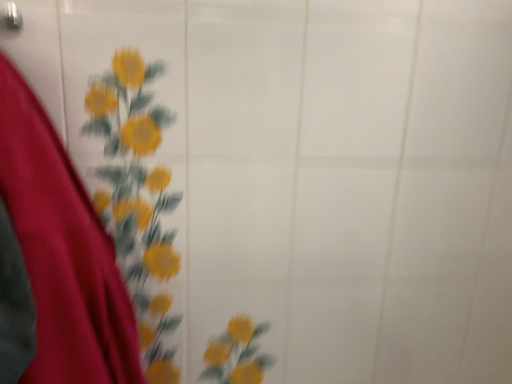
Question: From the image's perspective, is velvet red dress at left under metallic silver door handle at upper left?

Choices:
 (A) yes
 (B) no

Answer: (A)

Question: Considering the relative sizes of velvet red dress at left and metallic silver door handle at upper left in the image provided, is velvet red dress at left wider than metallic silver door handle at upper left?

Choices:
 (A) yes
 (B) no

Answer: (A)

Question: From the image's perspective, would you say velvet red dress at left is positioned over metallic silver door handle at upper left?

Choices:
 (A) yes
 (B) no

Answer: (B)

Question: From a real-world perspective, is velvet red dress at left below metallic silver door handle at upper left?

Choices:
 (A) yes
 (B) no

Answer: (A)

Question: Is the surface of velvet red dress at left in direct contact with metallic silver door handle at upper left?

Choices:
 (A) yes
 (B) no

Answer: (B)

Question: Is velvet red dress at left to the left of metallic silver door handle at upper left from the viewer's perspective?

Choices:
 (A) no
 (B) yes

Answer: (A)

Question: From the image's perspective, is metallic silver door handle at upper left located above velvet red dress at left?

Choices:
 (A) yes
 (B) no

Answer: (A)

Question: Does metallic silver door handle at upper left contain velvet red dress at left?

Choices:
 (A) no
 (B) yes

Answer: (A)

Question: Is metallic silver door handle at upper left wider than velvet red dress at left?

Choices:
 (A) no
 (B) yes

Answer: (A)

Question: From a real-world perspective, is metallic silver door handle at upper left positioned under velvet red dress at left based on gravity?

Choices:
 (A) yes
 (B) no

Answer: (B)

Question: Is metallic silver door handle at upper left oriented towards velvet red dress at left?

Choices:
 (A) yes
 (B) no

Answer: (B)

Question: Is metallic silver door handle at upper left at the right side of velvet red dress at left?

Choices:
 (A) yes
 (B) no

Answer: (B)

Question: Considering the positions of point (39, 274) and point (7, 23), is point (39, 274) closer or farther from the camera than point (7, 23)?

Choices:
 (A) farther
 (B) closer

Answer: (B)